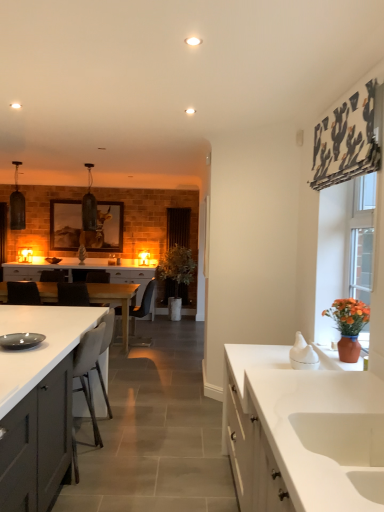
Question: Is the position of clear glass door at right less distant than that of black leather chair at center, which is the first chair in back-to-front order?

Choices:
 (A) no
 (B) yes

Answer: (B)

Question: Is clear glass door at right smaller than black leather chair at center, the second chair from the left?

Choices:
 (A) yes
 (B) no

Answer: (A)

Question: From the image's perspective, is clear glass door at right below black leather chair at center, the second chair from the left?

Choices:
 (A) no
 (B) yes

Answer: (A)

Question: Can you confirm if clear glass door at right is taller than black leather chair at center, the 3th chair in the right-to-left sequence?

Choices:
 (A) no
 (B) yes

Answer: (B)

Question: Can you confirm if clear glass door at right is shorter than black leather chair at center, which is the first chair in back-to-front order?

Choices:
 (A) yes
 (B) no

Answer: (B)

Question: Can you confirm if clear glass door at right is positioned to the left of black leather chair at center, arranged as the fourth chair when viewed from the front?

Choices:
 (A) yes
 (B) no

Answer: (B)

Question: Does white glossy sink at lower right have a larger size compared to black leather chair at left, the third chair viewed from the front?

Choices:
 (A) no
 (B) yes

Answer: (A)

Question: Is white glossy sink at lower right at the right side of black leather chair at left, the third chair viewed from the front?

Choices:
 (A) no
 (B) yes

Answer: (B)

Question: Is white glossy sink at lower right positioned far away from black leather chair at left, the 4th chair viewed from the right?

Choices:
 (A) no
 (B) yes

Answer: (B)

Question: From a real-world perspective, is white glossy sink at lower right located beneath black leather chair at left, the second chair positioned from the back?

Choices:
 (A) yes
 (B) no

Answer: (B)

Question: Is white glossy sink at lower right smaller than black leather chair at left, the second chair positioned from the back?

Choices:
 (A) no
 (B) yes

Answer: (B)

Question: From the image's perspective, would you say white glossy sink at lower right is shown under black leather chair at left, the second chair positioned from the back?

Choices:
 (A) no
 (B) yes

Answer: (B)

Question: From a real-world perspective, is white glossy cabinet at center, the first cabinetry positioned from the back, physically above black leather chair at center, marked as the 2th chair in a right-to-left arrangement?

Choices:
 (A) no
 (B) yes

Answer: (B)